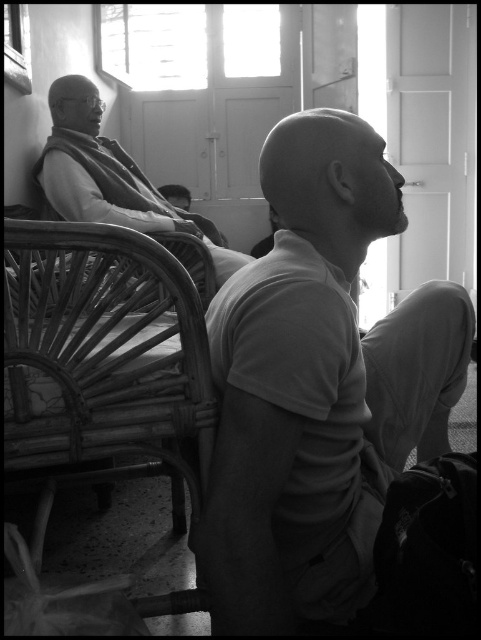
Question: Based on their relative distances, which object is farther from the white cotton shirt at center?

Choices:
 (A) matte black robe at left
 (B) woven wood chair at left

Answer: (A)

Question: Is woven wood chair at left to the right of matte black robe at left from the viewer's perspective?

Choices:
 (A) yes
 (B) no

Answer: (A)

Question: Does white cotton shirt at center have a greater width compared to matte black robe at left?

Choices:
 (A) no
 (B) yes

Answer: (A)

Question: Does white cotton shirt at center have a larger size compared to matte black robe at left?

Choices:
 (A) yes
 (B) no

Answer: (B)

Question: Among these objects, which one is farthest from the camera?

Choices:
 (A) white cotton shirt at center
 (B) woven wood chair at left
 (C) matte black robe at left

Answer: (C)

Question: Which point is closer to the camera?

Choices:
 (A) (174, 216)
 (B) (161, 310)
 (C) (329, 602)

Answer: (B)